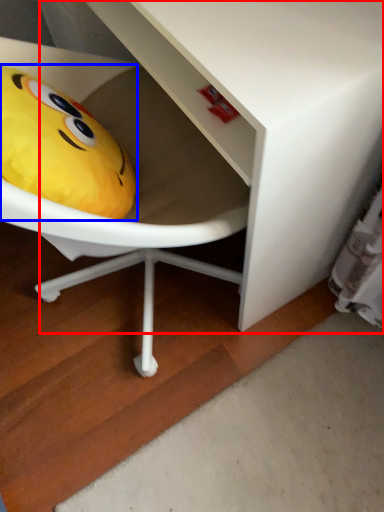
Question: Which of the following is the closest to the observer, vanity (highlighted by a red box) or toy (highlighted by a blue box)?

Choices:
 (A) vanity
 (B) toy

Answer: (A)